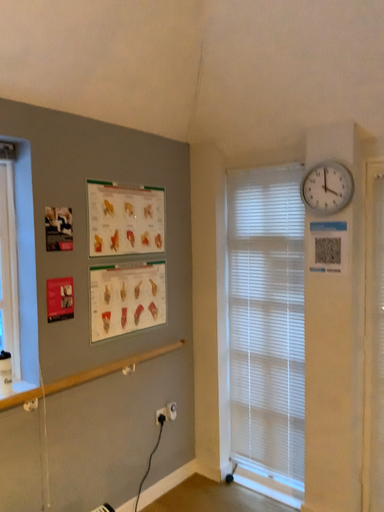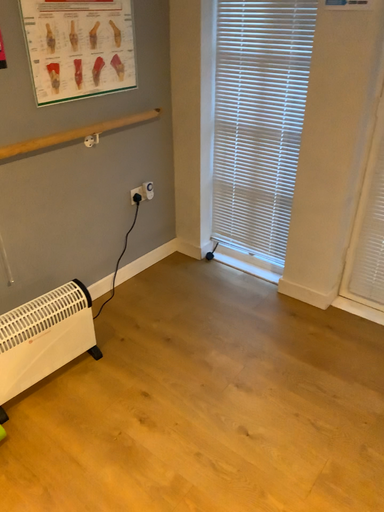
Question: Which way did the camera rotate in the video?

Choices:
 (A) rotated downward
 (B) rotated upward

Answer: (A)